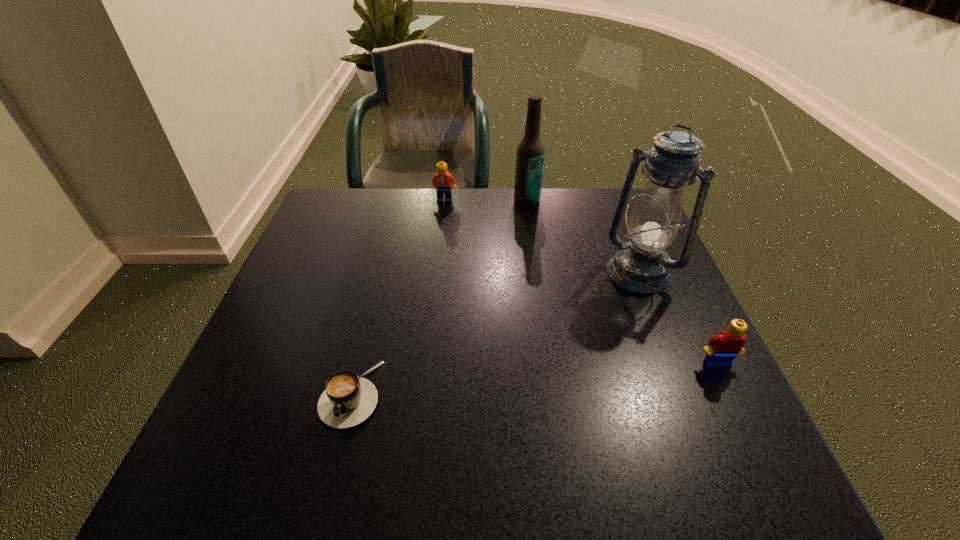
In order to click on vacant space that is in between the tallest object and the cappuccino in this screenshot , I will do `click(494, 333)`.

Identify the location of blank region between the fourth shortest object and the shortest object. Image resolution: width=960 pixels, height=540 pixels. (439, 298).

I want to click on free spot between the beer bottle and the leftmost object, so click(439, 298).

This screenshot has width=960, height=540. Find the location of `vacant point located between the beer bottle and the lantern`. vacant point located between the beer bottle and the lantern is located at coordinates (583, 237).

Identify the location of free spot between the beer bottle and the tallest object. (583, 237).

Locate an element on the screen. Image resolution: width=960 pixels, height=540 pixels. vacant space in between the third object from right to left and the cappuccino is located at coordinates (439, 298).

The height and width of the screenshot is (540, 960). Identify the location of vacant space that's between the nearer Lego and the tallest object. (678, 318).

Locate which object ranks fourth in proximity to the beer bottle. Please provide its 2D coordinates. Your answer should be formatted as a tuple, i.e. [(x, y)], where the tuple contains the x and y coordinates of a point satisfying the conditions above.

[(348, 400)]

Identify which object is located as the second nearest to the third object from right to left. Please provide its 2D coordinates. Your answer should be formatted as a tuple, i.e. [(x, y)], where the tuple contains the x and y coordinates of a point satisfying the conditions above.

[(641, 265)]

Where is `vacant space that satisfies the following two spatial constraints: 1. on the front side of the lantern; 2. on the left side of the beer bottle`? vacant space that satisfies the following two spatial constraints: 1. on the front side of the lantern; 2. on the left side of the beer bottle is located at coordinates click(538, 273).